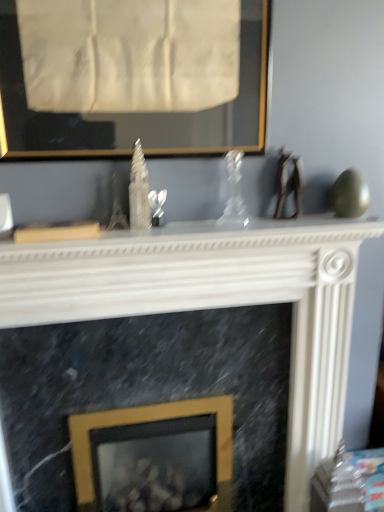
You are a GUI agent. You are given a task and a screenshot of the screen. Output one action in this format:
    pyautogui.click(x=<x>, y=<y>)
    Task: Click on the gold metallic picture frame at center, marked as the second picture frame in a front-to-back arrangement
    
    Given the screenshot: What is the action you would take?
    pyautogui.click(x=154, y=456)

Describe the element at coordinates (215, 300) in the screenshot. This screenshot has height=512, width=384. I see `white marble fireplace at center` at that location.

Where is `gold-framed picture at upper center, which ranks as the 2th picture frame in back-to-front order`? Image resolution: width=384 pixels, height=512 pixels. gold-framed picture at upper center, which ranks as the 2th picture frame in back-to-front order is located at coordinates (138, 113).

From the image's perspective, which one is positioned higher, white marble fireplace at center or transparent glass vase at center?

transparent glass vase at center is shown above in the image.

Is point (5, 505) positioned before point (238, 182)?

No.

Can you tell me how much white marble fireplace at center and transparent glass vase at center differ in facing direction?

white marble fireplace at center and transparent glass vase at center are facing 0.0171 degrees away from each other.

Can you confirm if white marble fireplace at center is thinner than transparent glass vase at center?

No, white marble fireplace at center is not thinner than transparent glass vase at center.

Considering the sizes of objects gold metallic picture frame at center, the second picture frame positioned from the top, and white marble fireplace at center in the image provided, who is smaller, gold metallic picture frame at center, the second picture frame positioned from the top, or white marble fireplace at center?

gold metallic picture frame at center, the second picture frame positioned from the top.

Can you confirm if gold metallic picture frame at center, the 1th picture frame ordered from the bottom, is positioned to the left of white marble fireplace at center?

Indeed, gold metallic picture frame at center, the 1th picture frame ordered from the bottom, is positioned on the left side of white marble fireplace at center.

Is gold metallic picture frame at center, marked as the second picture frame in a front-to-back arrangement, turned away from white marble fireplace at center?

No, gold metallic picture frame at center, marked as the second picture frame in a front-to-back arrangement,'s orientation is not away from white marble fireplace at center.

Image resolution: width=384 pixels, height=512 pixels. I want to click on the 1st picture frame to the left when counting from the white marble fireplace at center, so click(x=154, y=456).

Which point is more forward, (255,151) or (203,460)?

The point (255,151) is in front.

This screenshot has height=512, width=384. In order to click on picture frame lying above the gold metallic picture frame at center, marked as the second picture frame in a front-to-back arrangement (from the image's perspective) in this screenshot , I will do `click(138, 113)`.

Is gold-framed picture at upper center, the second picture frame from the bottom, aimed at gold metallic picture frame at center, the second picture frame positioned from the top?

No, gold-framed picture at upper center, the second picture frame from the bottom, is not aimed at gold metallic picture frame at center, the second picture frame positioned from the top.

From a real-world perspective, which is physically below, gold-framed picture at upper center, which is the first picture frame in front-to-back order, or gold metallic picture frame at center, marked as the second picture frame in a front-to-back arrangement?

In real-world perspective, gold metallic picture frame at center, marked as the second picture frame in a front-to-back arrangement, is lower.

Considering the sizes of objects white marble fireplace at center and gold metallic picture frame at center, marked as the first picture frame in a back-to-front arrangement, in the image provided, who is shorter, white marble fireplace at center or gold metallic picture frame at center, marked as the first picture frame in a back-to-front arrangement,?

gold metallic picture frame at center, marked as the first picture frame in a back-to-front arrangement, is shorter.

Can you confirm if white marble fireplace at center is bigger than gold metallic picture frame at center, marked as the first picture frame in a back-to-front arrangement?

Yes.

Could you measure the distance between white marble fireplace at center and gold metallic picture frame at center, marked as the first picture frame in a back-to-front arrangement?

white marble fireplace at center is 16.92 inches from gold metallic picture frame at center, marked as the first picture frame in a back-to-front arrangement.

Considering the relative sizes of white marble fireplace at center and gold metallic picture frame at center, the second picture frame positioned from the top, in the image provided, is white marble fireplace at center thinner than gold metallic picture frame at center, the second picture frame positioned from the top,?

Yes, white marble fireplace at center is thinner than gold metallic picture frame at center, the second picture frame positioned from the top.

Who is smaller, transparent glass vase at center or gold metallic picture frame at center, marked as the first picture frame in a back-to-front arrangement?

Result: With smaller size is transparent glass vase at center.

Considering the relative positions of transparent glass vase at center and gold metallic picture frame at center, marked as the second picture frame in a front-to-back arrangement, in the image provided, is transparent glass vase at center in front of gold metallic picture frame at center, marked as the second picture frame in a front-to-back arrangement,?

Yes.

Is point (239, 219) closer to viewer compared to point (127, 467)?

Yes.

From a real-world perspective, is transparent glass vase at center physically located above or below gold-framed picture at upper center, the second picture frame from the bottom?

From a real-world perspective, transparent glass vase at center is physically below gold-framed picture at upper center, the second picture frame from the bottom.

Which is behind, point (225, 223) or point (204, 122)?

Point (225, 223)

Considering the sizes of objects transparent glass vase at center and gold-framed picture at upper center, the second picture frame from the bottom, in the image provided, who is bigger, transparent glass vase at center or gold-framed picture at upper center, the second picture frame from the bottom,?

With larger size is gold-framed picture at upper center, the second picture frame from the bottom.

From the image's perspective, is transparent glass vase at center under white marble fireplace at center?

No, from the image's perspective, transparent glass vase at center is not below white marble fireplace at center.

From a real-world perspective, is transparent glass vase at center located beneath white marble fireplace at center?

No, from a real-world perspective, transparent glass vase at center is not under white marble fireplace at center.

Is transparent glass vase at center turned away from white marble fireplace at center?

No, white marble fireplace at center is not at the back of transparent glass vase at center.

Is transparent glass vase at center positioned before white marble fireplace at center?

No.

You are a GUI agent. You are given a task and a screenshot of the screen. Output one action in this format:
    pyautogui.click(x=<x>, y=<y>)
    Task: Click on the fireplace lying on the left of transparent glass vase at center
    
    Given the screenshot: What is the action you would take?
    pyautogui.click(x=215, y=300)

This screenshot has height=512, width=384. In order to click on picture frame located behind the white marble fireplace at center in this screenshot , I will do `click(154, 456)`.

Which object lies further to the anchor point white marble fireplace at center, gold metallic picture frame at center, the second picture frame positioned from the top, or gold-framed picture at upper center, which ranks as the 2th picture frame in back-to-front order?

gold-framed picture at upper center, which ranks as the 2th picture frame in back-to-front order, is positioned further to the anchor white marble fireplace at center.

Based on their spatial positions, is gold metallic picture frame at center, marked as the second picture frame in a front-to-back arrangement, or gold-framed picture at upper center, the 1th picture frame when ordered from top to bottom, closer to transparent glass vase at center?

Based on the image, gold-framed picture at upper center, the 1th picture frame when ordered from top to bottom, appears to be nearer to transparent glass vase at center.

From the image, which object appears to be nearer to transparent glass vase at center, white marble fireplace at center or gold-framed picture at upper center, the 1th picture frame when ordered from top to bottom?

gold-framed picture at upper center, the 1th picture frame when ordered from top to bottom.

Looking at the image, which one is located closer to white marble fireplace at center, transparent glass vase at center or gold metallic picture frame at center, the second picture frame positioned from the top?

transparent glass vase at center lies closer to white marble fireplace at center than the other object.

From the image, which object appears to be nearer to gold metallic picture frame at center, the second picture frame positioned from the top, gold-framed picture at upper center, the 1th picture frame when ordered from top to bottom, or transparent glass vase at center?

transparent glass vase at center is closer to gold metallic picture frame at center, the second picture frame positioned from the top.

Which object lies nearer to the anchor point gold-framed picture at upper center, which ranks as the 2th picture frame in back-to-front order, white marble fireplace at center or transparent glass vase at center?

transparent glass vase at center is closer to gold-framed picture at upper center, which ranks as the 2th picture frame in back-to-front order.

When comparing their distances from transparent glass vase at center, does gold-framed picture at upper center, which ranks as the 2th picture frame in back-to-front order, or white marble fireplace at center seem further?

Among the two, white marble fireplace at center is located further to transparent glass vase at center.

Estimate the real-world distances between objects in this image. Which object is further from gold metallic picture frame at center, marked as the second picture frame in a front-to-back arrangement, transparent glass vase at center or gold-framed picture at upper center, the 1th picture frame when ordered from top to bottom?

gold-framed picture at upper center, the 1th picture frame when ordered from top to bottom, is positioned further to the anchor gold metallic picture frame at center, marked as the second picture frame in a front-to-back arrangement.

I want to click on fireplace between gold-framed picture at upper center, which ranks as the 2th picture frame in back-to-front order, and gold metallic picture frame at center, marked as the second picture frame in a front-to-back arrangement, vertically, so click(215, 300).

I want to click on fireplace between transparent glass vase at center and gold metallic picture frame at center, the 1th picture frame ordered from the bottom, vertically, so click(x=215, y=300).

Identify the location of glass vase between gold-framed picture at upper center, which ranks as the 2th picture frame in back-to-front order, and white marble fireplace at center vertically. The width and height of the screenshot is (384, 512). (234, 194).

Find the location of a particular element. The image size is (384, 512). glass vase between gold-framed picture at upper center, which is the first picture frame in front-to-back order, and gold metallic picture frame at center, marked as the first picture frame in a back-to-front arrangement, vertically is located at coordinates (234, 194).